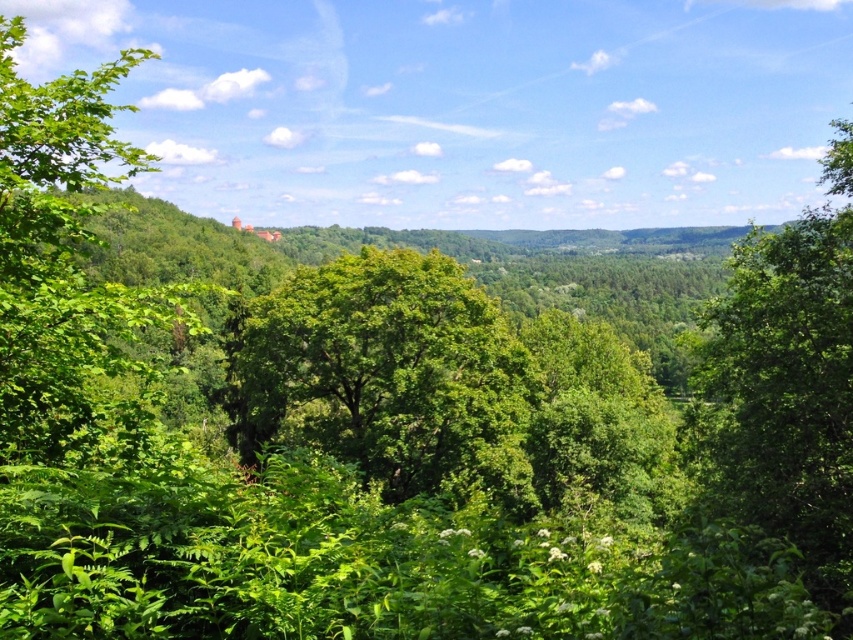
Which is in front, point (68, 236) or point (735, 416)?

Positioned in front is point (68, 236).

Between point (9, 164) and point (770, 371), which one is positioned behind?

The point (770, 371) is more distant.

This screenshot has width=853, height=640. Find the location of `green leafy tree at left`. green leafy tree at left is located at coordinates 68,273.

Between green leafy tree at center and green leafy tree at right, which one has more height?

green leafy tree at center is taller.

In the scene shown: Does green leafy tree at center have a smaller size compared to green leafy tree at right?

No, green leafy tree at center is not smaller than green leafy tree at right.

Who is more forward, (335, 381) or (703, 499)?

Point (703, 499) is more forward.

The height and width of the screenshot is (640, 853). What are the coordinates of `green leafy tree at center` in the screenshot? It's located at coord(393,374).

Who is taller, green leafy tree at center or green leafy tree at left?

green leafy tree at left

Does point (260, 298) come in front of point (74, 168)?

No.

Image resolution: width=853 pixels, height=640 pixels. Find the location of `green leafy tree at center`. green leafy tree at center is located at coordinates (393, 374).

At what (x,y) coordinates should I click in order to perform the action: click on green leafy tree at center. Please return your answer as a coordinate pair (x, y). The width and height of the screenshot is (853, 640). Looking at the image, I should click on (393, 374).